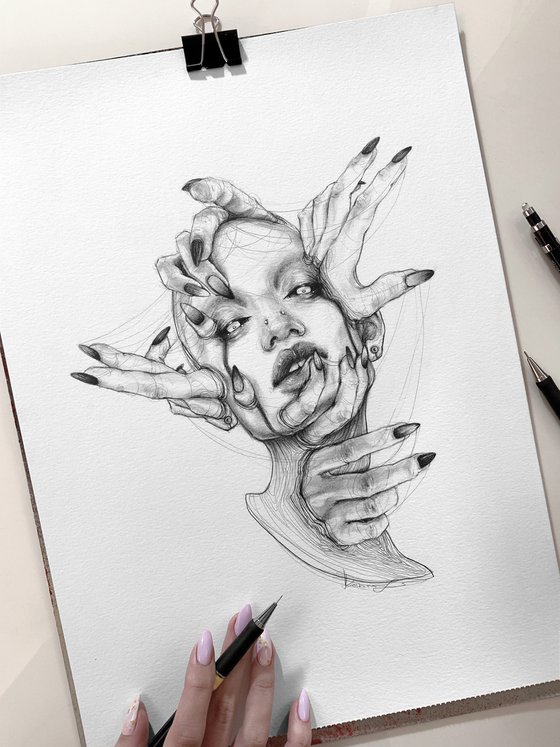
The height and width of the screenshot is (747, 560). I want to click on black barrel of pen, so [237, 648].